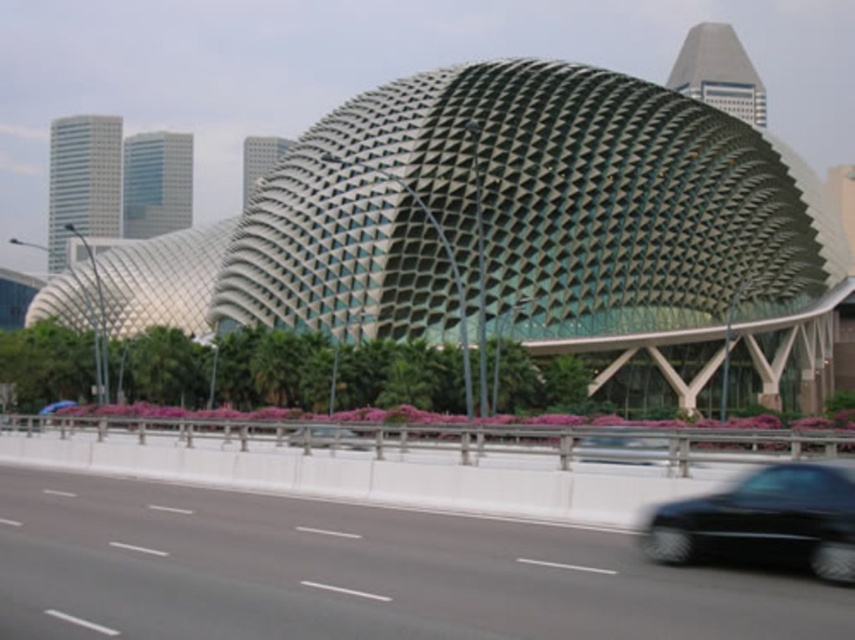
Image resolution: width=855 pixels, height=640 pixels. In order to click on black metallic car at center in this screenshot , I will do `click(622, 449)`.

Measure the distance between black metallic car at center and camera.

black metallic car at center is 120.00 feet away from camera.

Where is `black metallic car at center`? The image size is (855, 640). black metallic car at center is located at coordinates (622, 449).

Can you confirm if green metallic dome at center is taller than shiny black car at lower right?

Yes.

Can you confirm if green metallic dome at center is positioned below shiny black car at lower right?

No, green metallic dome at center is not below shiny black car at lower right.

What do you see at coordinates (528, 224) in the screenshot? I see `green metallic dome at center` at bounding box center [528, 224].

Locate an element on the screen. This screenshot has width=855, height=640. green metallic dome at center is located at coordinates (528, 224).

Does gray asphalt highway at lower center lie in front of black glossy car at center?

Yes, it is.

Looking at this image, who is more distant from viewer, (506, 566) or (310, 433)?

Point (310, 433)

Image resolution: width=855 pixels, height=640 pixels. I want to click on gray asphalt highway at lower center, so click(x=352, y=573).